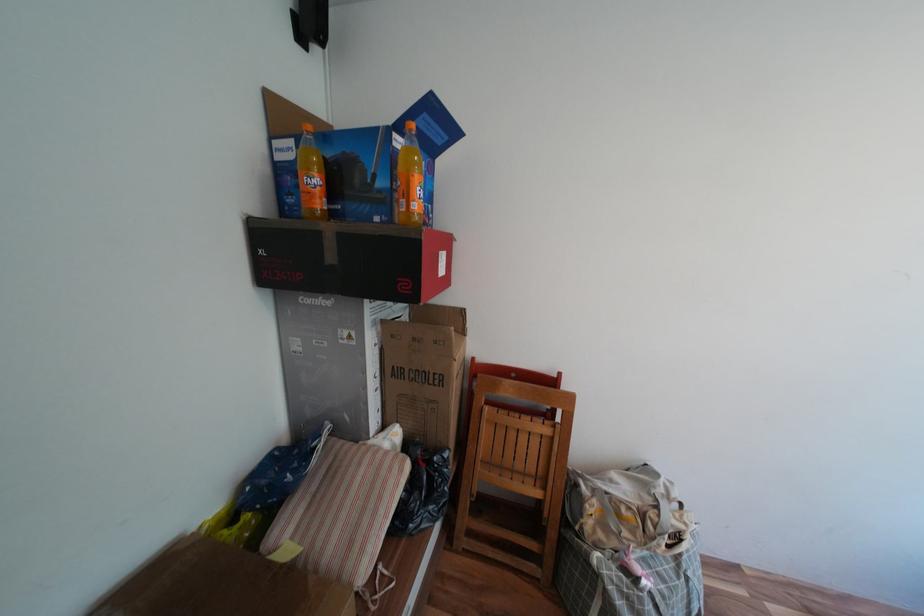
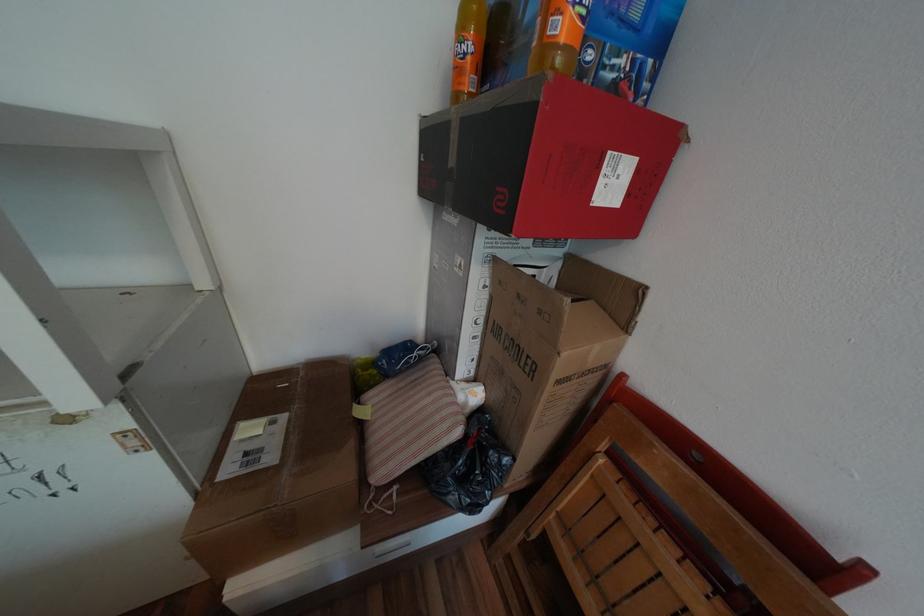
Find the pixel in the second image that matches point 319,169 in the first image.

(472, 31)